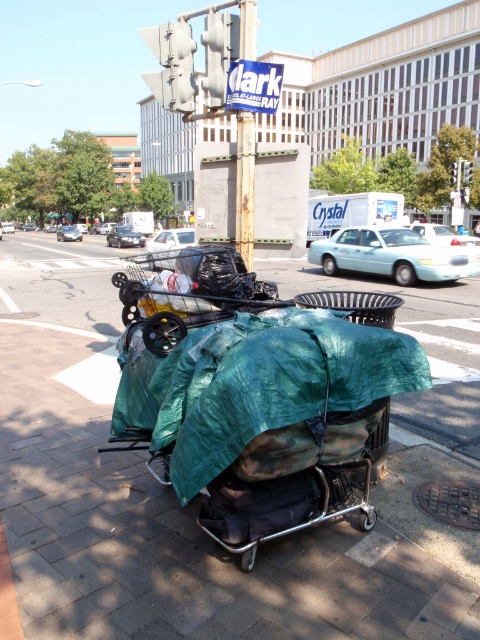
At what (x,y) coordinates should I click in order to perform the action: click on green tarpaulin at center. Please return your answer as a coordinate pair (x, y). This screenshot has width=480, height=640. Looking at the image, I should click on (193, 506).

Can you confirm if green tarpaulin at center is thinner than green fabric trolley at center?

No.

The width and height of the screenshot is (480, 640). Find the location of `green tarpaulin at center`. green tarpaulin at center is located at coordinates (193, 506).